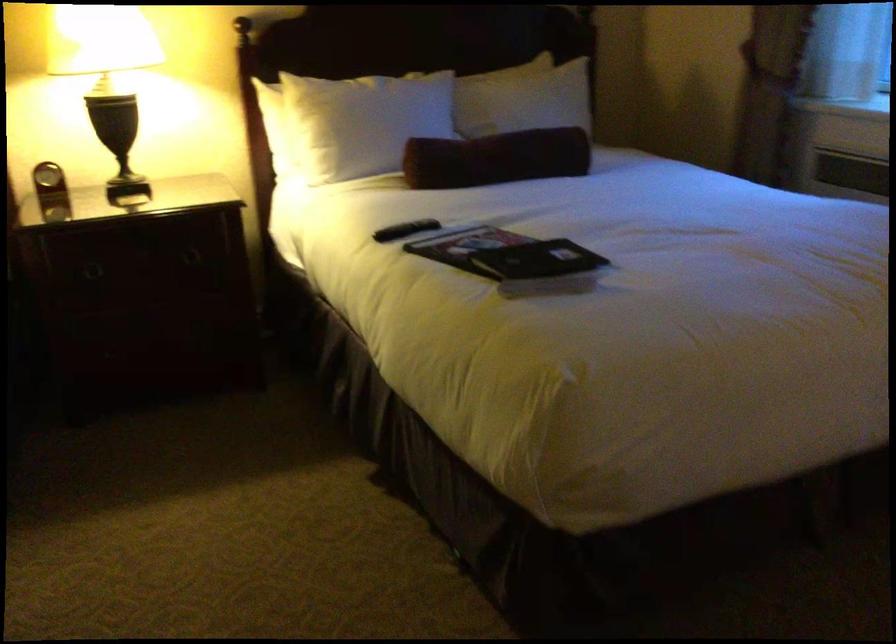
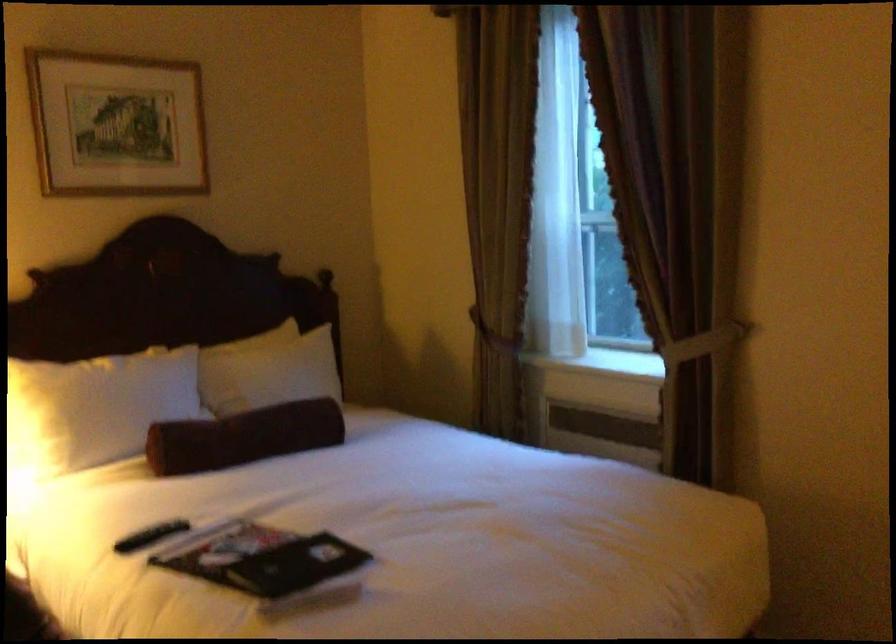
Question: The camera is either moving clockwise (left) or counter-clockwise (right) around the object. The first image is from the beginning of the video and the second image is from the end. Is the camera moving left or right when shooting the video?

Choices:
 (A) Left
 (B) Right

Answer: (A)